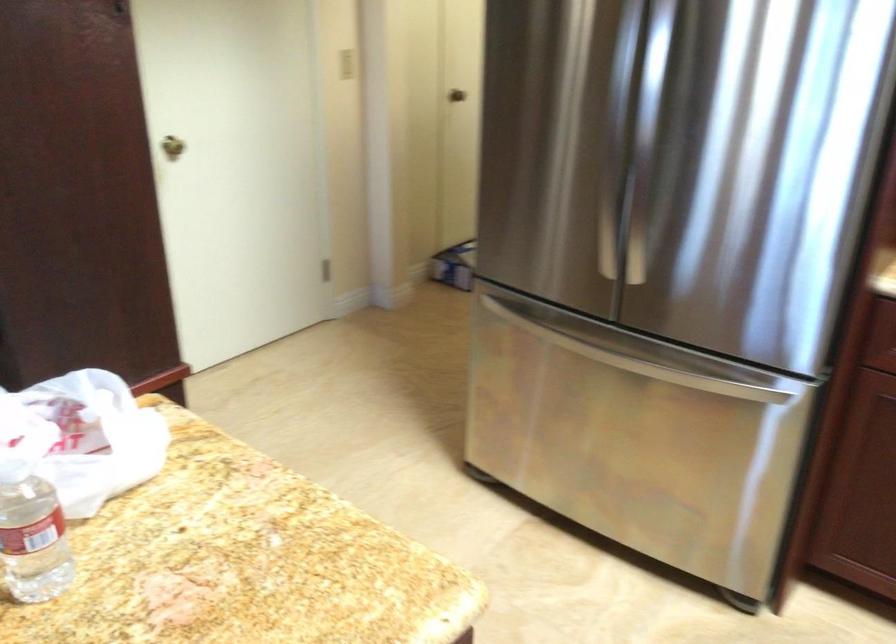
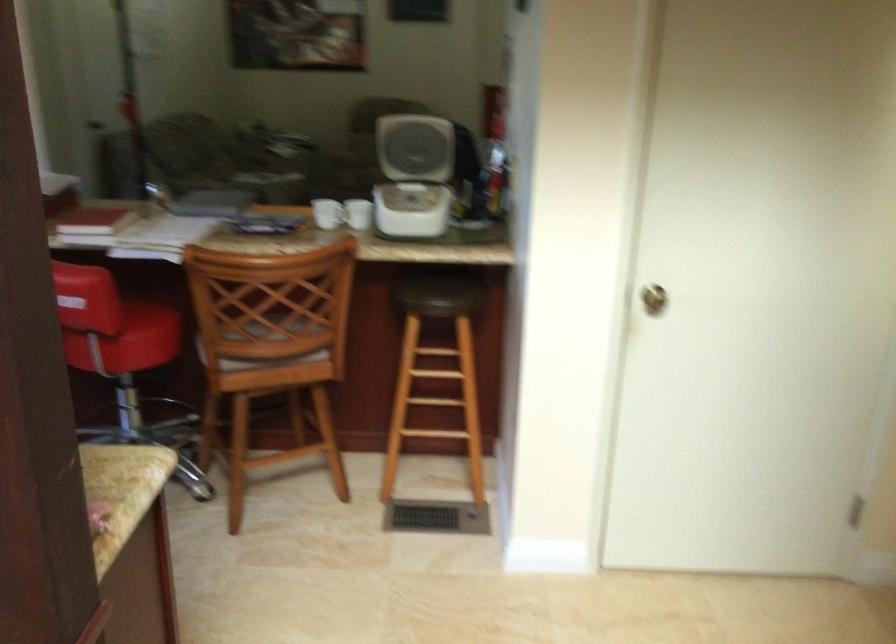
The point at (192, 147) is marked in the first image. Where is the corresponding point in the second image?

(653, 299)